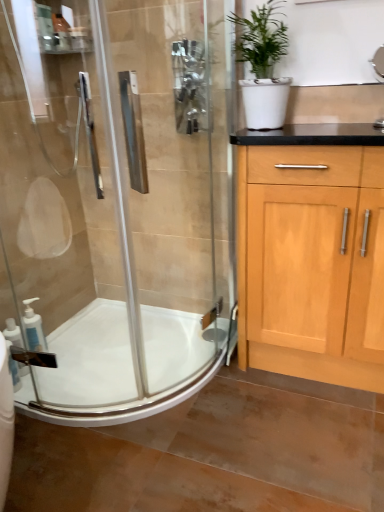
The height and width of the screenshot is (512, 384). What do you see at coordinates (13, 333) in the screenshot?
I see `white glossy soap dispenser at lower left, placed as the 1th soap dispenser when sorted from front to back` at bounding box center [13, 333].

Describe the element at coordinates (33, 327) in the screenshot. I see `white matte soap dispenser at lower left, the 2th soap dispenser from the front` at that location.

The height and width of the screenshot is (512, 384). What are the coordinates of `white glossy soap dispenser at lower left, placed as the 1th soap dispenser when sorted from front to back` in the screenshot? It's located at (13, 333).

Looking at this image, would you consider white glossy soap dispenser at lower left, placed as the 1th soap dispenser when sorted from front to back, to be distant from white matte pot at upper right?

Yes, white glossy soap dispenser at lower left, placed as the 1th soap dispenser when sorted from front to back, and white matte pot at upper right are quite far apart.

From a real-world perspective, which is physically below, white glossy soap dispenser at lower left, placed as the 1th soap dispenser when sorted from front to back, or white matte pot at upper right?

From a 3D spatial view, white glossy soap dispenser at lower left, placed as the 1th soap dispenser when sorted from front to back, is below.

Between white glossy soap dispenser at lower left, placed as the 1th soap dispenser when sorted from front to back, and white matte pot at upper right, which one is positioned behind?

white glossy soap dispenser at lower left, placed as the 1th soap dispenser when sorted from front to back, is more distant.

The image size is (384, 512). What are the coordinates of `bath directly beneath the white matte pot at upper right (from a real-world perspective)` in the screenshot? It's located at (119, 366).

Are white matte pot at upper right and white glossy bath at lower left far apart?

That's right, there is a large distance between white matte pot at upper right and white glossy bath at lower left.

Between white matte pot at upper right and white glossy bath at lower left, which one appears on the right side from the viewer's perspective?

white matte pot at upper right is more to the right.

Considering the relative positions of white glossy soap dispenser at lower left, placed as the 1th soap dispenser when sorted from front to back, and white glossy sink at upper right in the image provided, is white glossy soap dispenser at lower left, placed as the 1th soap dispenser when sorted from front to back, behind white glossy sink at upper right?

Yes, white glossy soap dispenser at lower left, placed as the 1th soap dispenser when sorted from front to back, is further from the viewer.

How different are the orientations of white glossy soap dispenser at lower left, placed as the 1th soap dispenser when sorted from front to back, and white glossy sink at upper right in degrees?

There is a 89.5-degree angle between the facing directions of white glossy soap dispenser at lower left, placed as the 1th soap dispenser when sorted from front to back, and white glossy sink at upper right.

Is white glossy soap dispenser at lower left, placed as the 1th soap dispenser when sorted from front to back, far away from white glossy sink at upper right?

Yes.

The width and height of the screenshot is (384, 512). I want to click on sink in front of the white glossy soap dispenser at lower left, the second soap dispenser in the back-to-front sequence, so click(378, 64).

Would you say white glossy bath at lower left is outside white glossy sink at upper right?

white glossy bath at lower left is positioned outside white glossy sink at upper right.

Between point (145, 327) and point (371, 60), which one is positioned behind?

The point (145, 327) is farther.

How much distance is there between white glossy bath at lower left and white glossy sink at upper right?

A distance of 4.77 feet exists between white glossy bath at lower left and white glossy sink at upper right.

Are white glossy bath at lower left and white glossy sink at upper right far apart?

white glossy bath at lower left is positioned a significant distance from white glossy sink at upper right.

From the image's perspective, is clear glass shower door at left on white glossy sink at upper right?

No, from the image's perspective, clear glass shower door at left is not over white glossy sink at upper right.

Between clear glass shower door at left and white glossy sink at upper right, which one is positioned behind?

Positioned behind is white glossy sink at upper right.

Considering the relative sizes of clear glass shower door at left and white glossy sink at upper right in the image provided, is clear glass shower door at left wider than white glossy sink at upper right?

Correct, the width of clear glass shower door at left exceeds that of white glossy sink at upper right.

Is clear glass shower door at left next to white glossy sink at upper right and touching it?

No, clear glass shower door at left is not touching white glossy sink at upper right.

Between point (117, 325) and point (245, 92), which one is positioned in front?

The point (245, 92) is closer to the camera.

Is clear glass shower door at left looking in the opposite direction of white matte pot at upper right?

No, clear glass shower door at left is not facing away from white matte pot at upper right.

Which of these two, clear glass shower door at left or white matte pot at upper right, stands taller?

clear glass shower door at left.

Can you confirm if clear glass shower door at left is thinner than white matte pot at upper right?

Correct, the width of clear glass shower door at left is less than that of white matte pot at upper right.

Is white matte pot at upper right far from clear glass shower door at left?

That's not correct — white matte pot at upper right is a little close to clear glass shower door at left.

Is white matte pot at upper right aimed at clear glass shower door at left?

No.

Considering the relative sizes of white matte pot at upper right and clear glass shower door at left in the image provided, is white matte pot at upper right taller than clear glass shower door at left?

Incorrect, the height of white matte pot at upper right is not larger of that of clear glass shower door at left.

Between white matte pot at upper right and clear glass shower door at left, which one has smaller width?

Thinner between the two is clear glass shower door at left.

Identify the location of houseplant in front of the white glossy soap dispenser at lower left, the second soap dispenser in the back-to-front sequence. (263, 66).

At what (x,y) coordinates should I click in order to perform the action: click on bath below the white matte pot at upper right (from a real-world perspective). Please return your answer as a coordinate pair (x, y). The width and height of the screenshot is (384, 512). Looking at the image, I should click on (119, 366).

When comparing their distances from white matte pot at upper right, does white glossy sink at upper right or white matte soap dispenser at lower left, the 1th soap dispenser positioned from the back, seem further?

Among the two, white matte soap dispenser at lower left, the 1th soap dispenser positioned from the back, is located further to white matte pot at upper right.

Which object lies further to the anchor point white matte pot at upper right, clear glass shower door at left or white glossy bath at lower left?

white glossy bath at lower left lies further to white matte pot at upper right than the other object.

Considering their positions, is white glossy soap dispenser at lower left, placed as the 1th soap dispenser when sorted from front to back, positioned closer to white matte soap dispenser at lower left, the 2th soap dispenser from the front, than white matte pot at upper right?

white glossy soap dispenser at lower left, placed as the 1th soap dispenser when sorted from front to back, lies closer to white matte soap dispenser at lower left, the 2th soap dispenser from the front, than the other object.

From the image, which object appears to be nearer to white matte soap dispenser at lower left, the 1th soap dispenser positioned from the back, white matte pot at upper right or white glossy soap dispenser at lower left, placed as the 1th soap dispenser when sorted from front to back?

Based on the image, white glossy soap dispenser at lower left, placed as the 1th soap dispenser when sorted from front to back, appears to be nearer to white matte soap dispenser at lower left, the 1th soap dispenser positioned from the back.

Estimate the real-world distances between objects in this image. Which object is closer to white glossy soap dispenser at lower left, placed as the 1th soap dispenser when sorted from front to back, white matte pot at upper right or white glossy bath at lower left?

The object closer to white glossy soap dispenser at lower left, placed as the 1th soap dispenser when sorted from front to back, is white glossy bath at lower left.

Based on their spatial positions, is white matte soap dispenser at lower left, the 1th soap dispenser positioned from the back, or white glossy soap dispenser at lower left, placed as the 1th soap dispenser when sorted from front to back, closer to clear glass shower door at left?

white matte soap dispenser at lower left, the 1th soap dispenser positioned from the back, is closer to clear glass shower door at left.

Estimate the real-world distances between objects in this image. Which object is further from white matte pot at upper right, white glossy sink at upper right or white glossy soap dispenser at lower left, placed as the 1th soap dispenser when sorted from front to back?

white glossy soap dispenser at lower left, placed as the 1th soap dispenser when sorted from front to back, is positioned further to the anchor white matte pot at upper right.

Which object lies further to the anchor point clear glass shower door at left, white glossy bath at lower left or white matte pot at upper right?

Among the two, white matte pot at upper right is located further to clear glass shower door at left.

Image resolution: width=384 pixels, height=512 pixels. In order to click on houseplant between white glossy soap dispenser at lower left, placed as the 1th soap dispenser when sorted from front to back, and white glossy sink at upper right, in the horizontal direction in this screenshot , I will do `click(263, 66)`.

Locate an element on the screen. The width and height of the screenshot is (384, 512). soap dispenser between white glossy soap dispenser at lower left, the second soap dispenser in the back-to-front sequence, and white glossy bath at lower left is located at coordinates (33, 327).

Find the location of a particular element. soap dispenser between white glossy soap dispenser at lower left, the second soap dispenser in the back-to-front sequence, and white glossy sink at upper right is located at coordinates (33, 327).

At what (x,y) coordinates should I click in order to perform the action: click on bath between clear glass shower door at left and white glossy sink at upper right. Please return your answer as a coordinate pair (x, y). Looking at the image, I should click on (119, 366).